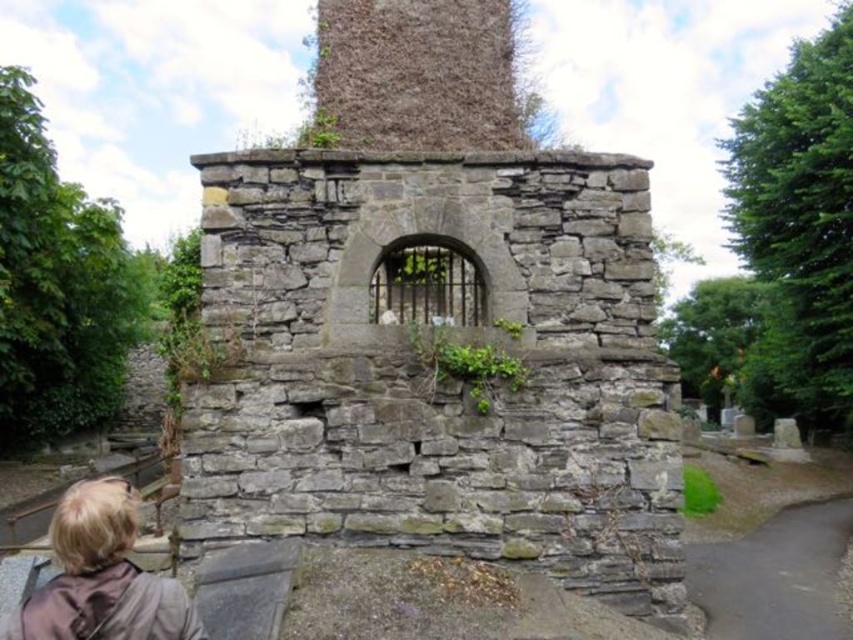
Is gray stone ruins at center taller than blonde hair at lower left?

Correct, gray stone ruins at center is much taller as blonde hair at lower left.

Which is behind, point (358, 88) or point (80, 541)?

The point (358, 88) is more distant.

Identify the location of gray stone ruins at center. (434, 326).